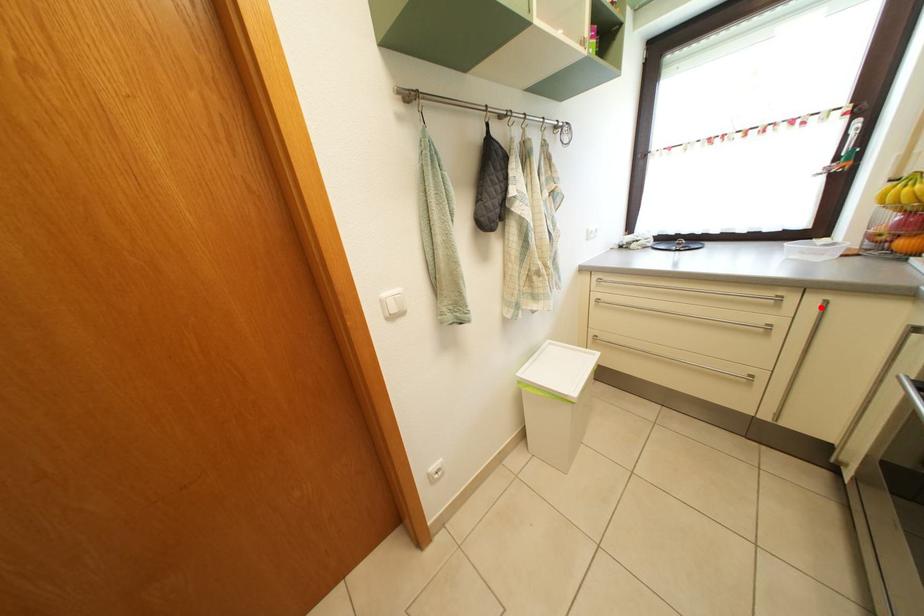
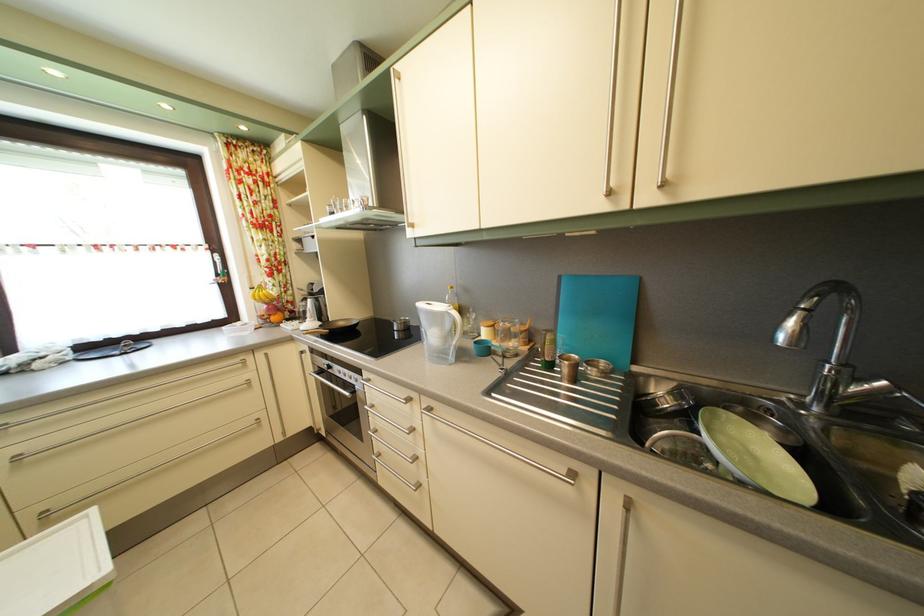
Locate, in the second image, the point that corresponds to the highlighted location in the first image.

(268, 363)